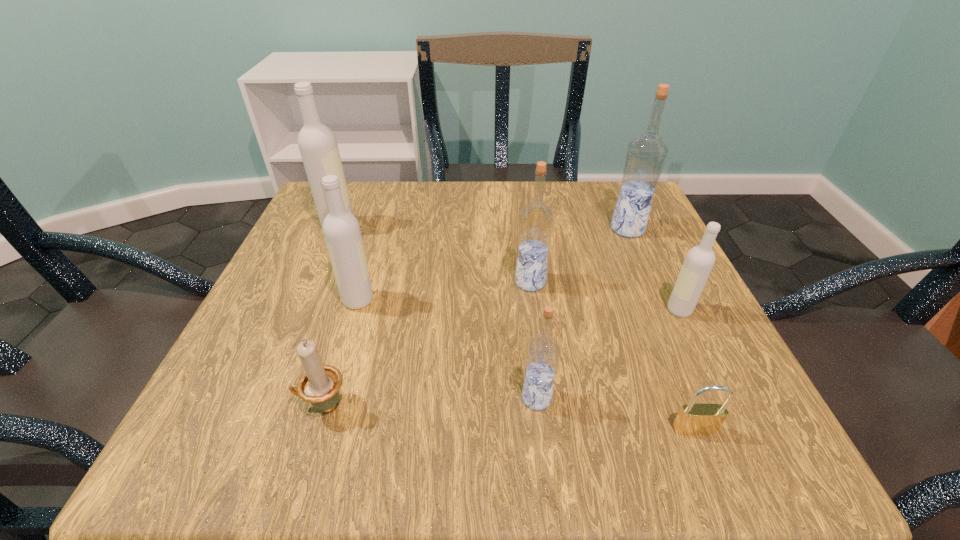
The height and width of the screenshot is (540, 960). I want to click on free spot between the biggest white vodka and the candle_holder, so click(331, 316).

Identify the location of vacant area between the biggest white vodka and the candle_holder. The height and width of the screenshot is (540, 960). (331, 316).

Where is `free point between the smallest white vodka and the rightmost blue vodka`? This screenshot has width=960, height=540. free point between the smallest white vodka and the rightmost blue vodka is located at coordinates (654, 269).

Find the location of a particular element. Image resolution: width=960 pixels, height=540 pixels. vacant space that's between the smallest white vodka and the nearest vodka is located at coordinates (608, 354).

Select which object appears as the second closest to the second biggest white vodka. Please provide its 2D coordinates. Your answer should be formatted as a tuple, i.e. [(x, y)], where the tuple contains the x and y coordinates of a point satisfying the conditions above.

[(317, 143)]

Select which object is the seventh closest to the brass padlock. Please provide its 2D coordinates. Your answer should be formatted as a tuple, i.e. [(x, y)], where the tuple contains the x and y coordinates of a point satisfying the conditions above.

[(317, 143)]

Find the location of a particular element. This screenshot has width=960, height=540. vodka that can be found as the third closest to the leftmost white vodka is located at coordinates (542, 355).

Locate an element on the screen. This screenshot has height=540, width=960. vodka that is the closest to the shortest object is located at coordinates (542, 355).

Locate which white vodka ranks third in proximity to the candle_holder. Please provide its 2D coordinates. Your answer should be formatted as a tuple, i.e. [(x, y)], where the tuple contains the x and y coordinates of a point satisfying the conditions above.

[(699, 261)]

Locate which white vodka is the closest to the padlock. Please provide its 2D coordinates. Your answer should be formatted as a tuple, i.e. [(x, y)], where the tuple contains the x and y coordinates of a point satisfying the conditions above.

[(699, 261)]